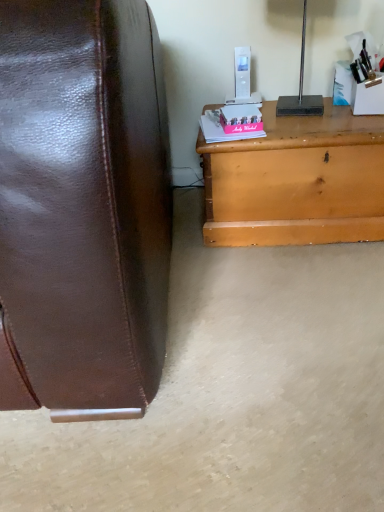
The height and width of the screenshot is (512, 384). What are the coordinates of `free space in front of wooden nightstand at right` in the screenshot? It's located at (296, 297).